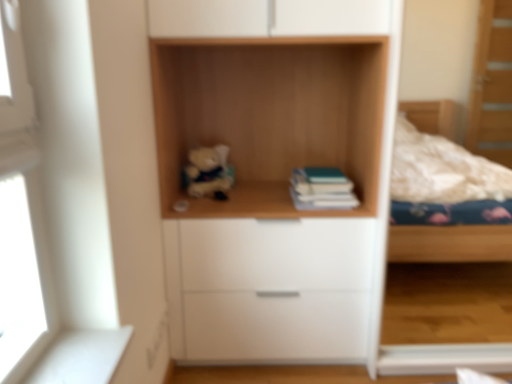
Question: Considering the relative sizes of wooden shelf at center and white matte drawer at center in the image provided, is wooden shelf at center smaller than white matte drawer at center?

Choices:
 (A) yes
 (B) no

Answer: (A)

Question: From a real-world perspective, is wooden shelf at center positioned under white matte drawer at center based on gravity?

Choices:
 (A) no
 (B) yes

Answer: (A)

Question: Is wooden shelf at center placed right next to white matte drawer at center?

Choices:
 (A) yes
 (B) no

Answer: (B)

Question: Considering the relative sizes of wooden shelf at center and white matte drawer at center in the image provided, is wooden shelf at center shorter than white matte drawer at center?

Choices:
 (A) yes
 (B) no

Answer: (A)

Question: Would you consider wooden shelf at center to be distant from white matte drawer at center?

Choices:
 (A) no
 (B) yes

Answer: (A)

Question: Can you confirm if wooden shelf at center is bigger than white matte drawer at center?

Choices:
 (A) yes
 (B) no

Answer: (B)

Question: From the image's perspective, is white matte drawer at center located beneath soft plush bear at center?

Choices:
 (A) no
 (B) yes

Answer: (B)

Question: From a real-world perspective, is white matte drawer at center located beneath soft plush bear at center?

Choices:
 (A) no
 (B) yes

Answer: (B)

Question: Considering the relative sizes of white matte drawer at center and soft plush bear at center in the image provided, is white matte drawer at center thinner than soft plush bear at center?

Choices:
 (A) no
 (B) yes

Answer: (A)

Question: Is white matte drawer at center turned away from soft plush bear at center?

Choices:
 (A) no
 (B) yes

Answer: (A)

Question: Is white matte drawer at center closer to camera compared to soft plush bear at center?

Choices:
 (A) yes
 (B) no

Answer: (A)

Question: Is white matte drawer at center not near soft plush bear at center?

Choices:
 (A) no
 (B) yes

Answer: (A)

Question: Is soft plush bear at center facing away from white matte drawer at center?

Choices:
 (A) yes
 (B) no

Answer: (B)